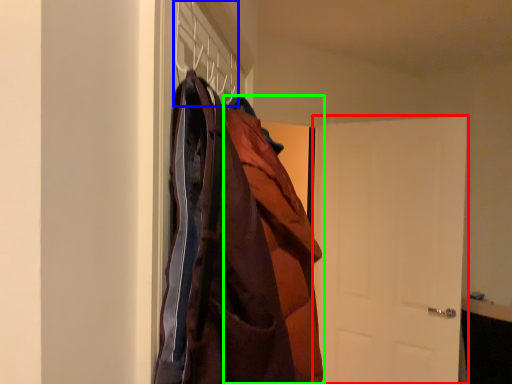
Question: Based on their relative distances, which object is nearer to door (highlighted by a red box)? Choose from hanger (highlighted by a blue box) and cloak (highlighted by a green box).

Choices:
 (A) hanger
 (B) cloak

Answer: (B)